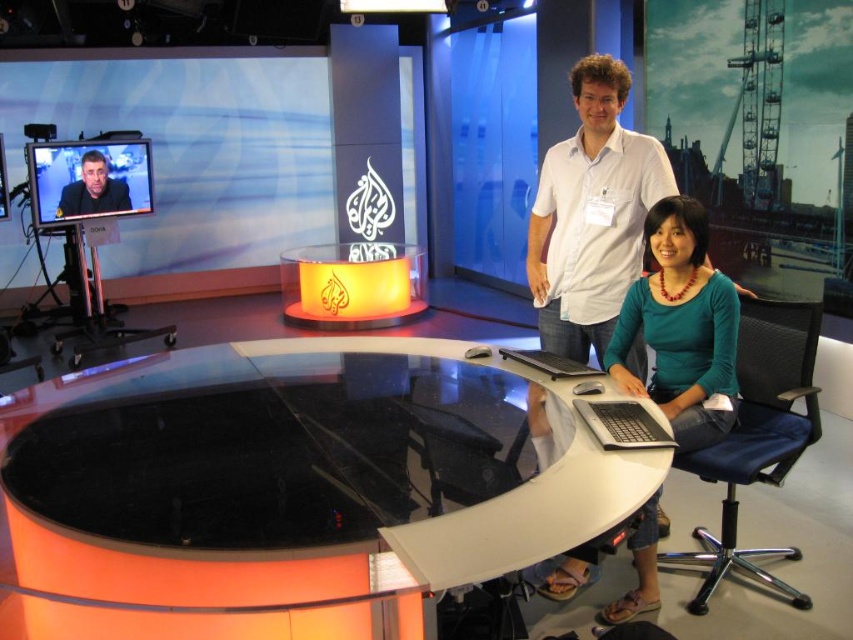
You are a guest entering the news studio and need to sit down. You see the teal jersey at center and the black mesh swivel chair at lower right. Which object should you sit on?

The black mesh swivel chair at lower right is the correct seating option. The teal jersey at center is positioned above it and likely belongs to someone else or is part of the studio decor, so you should sit on the black mesh swivel chair at lower right.